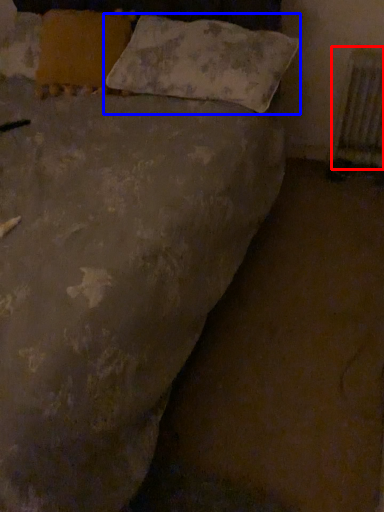
Question: Which object appears closest to the camera in this image, radiator (highlighted by a red box) or pillow (highlighted by a blue box)?

Choices:
 (A) radiator
 (B) pillow

Answer: (B)